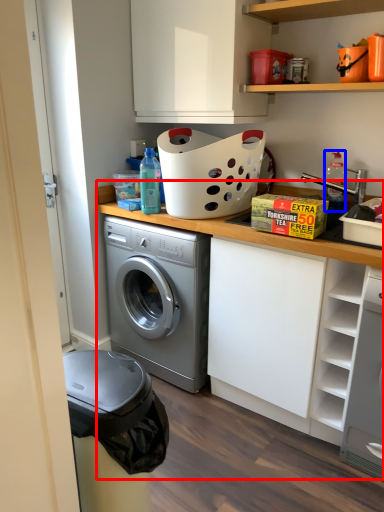
Question: Which object is closer to the camera taking this photo, counter top (highlighted by a red box) or bottle (highlighted by a blue box)?

Choices:
 (A) counter top
 (B) bottle

Answer: (A)